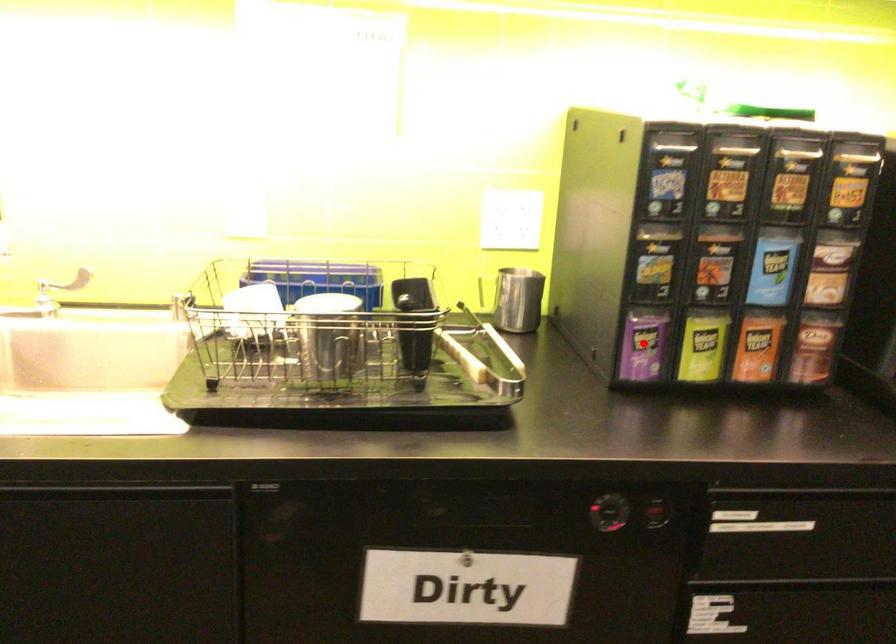
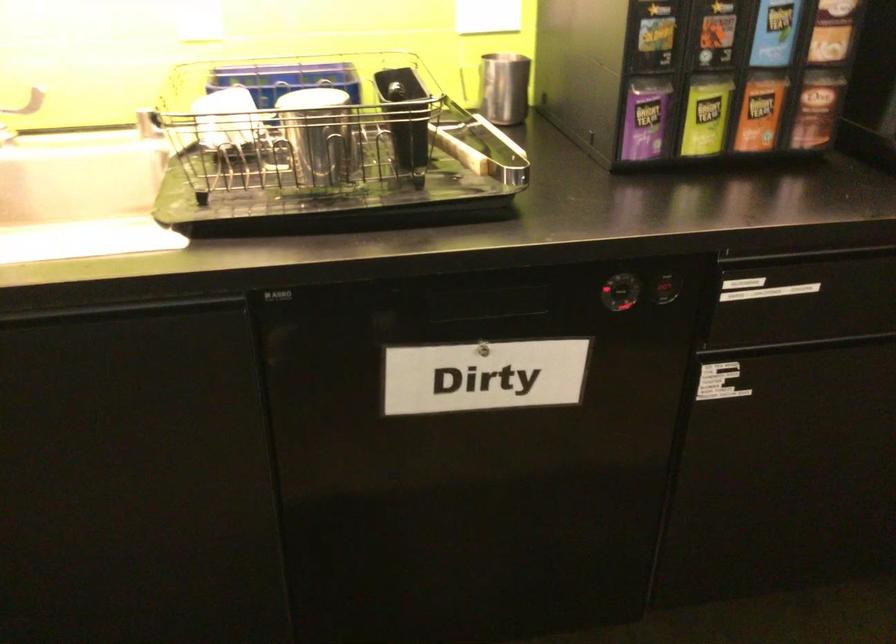
Find the pixel in the second image that matches the highlighted location in the first image.

(645, 118)